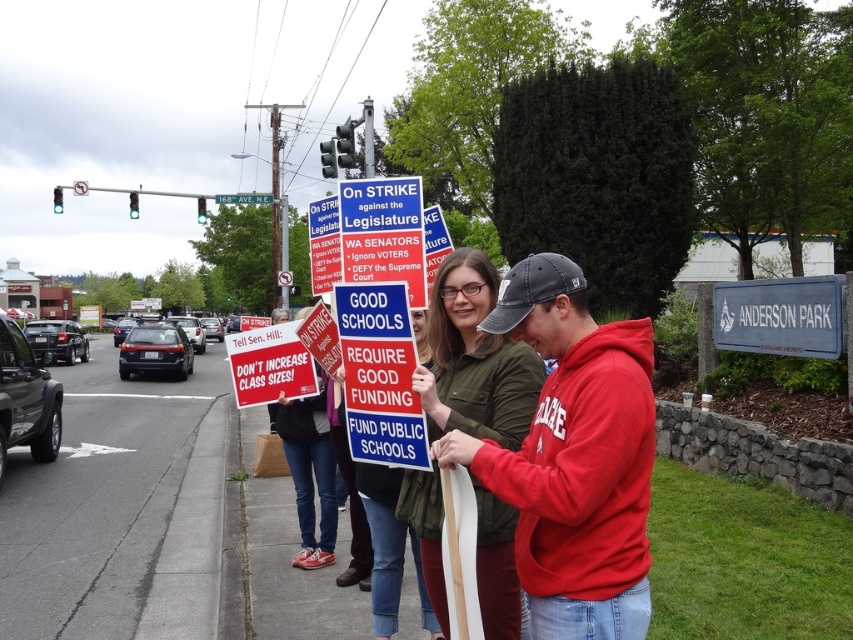
Does green fabric jacket at center appear on the left side of red plastic sign at center?

Incorrect, green fabric jacket at center is not on the left side of red plastic sign at center.

Measure the distance between point (500, 536) and camera.

Point (500, 536) and camera are 2.60 meters apart from each other.

I want to click on green fabric jacket at center, so click(474, 358).

The height and width of the screenshot is (640, 853). Describe the element at coordinates (573, 458) in the screenshot. I see `red fleece hoodie at center` at that location.

Between red fleece hoodie at center and red plastic sign at center, which one appears on the right side from the viewer's perspective?

Positioned to the right is red fleece hoodie at center.

Is point (479, 445) more distant than point (308, 380)?

That is False.

At what (x,y) coordinates should I click in order to perform the action: click on red fleece hoodie at center. Please return your answer as a coordinate pair (x, y). The image size is (853, 640). Looking at the image, I should click on (573, 458).

Between green fabric jacket at center and metallic blue street sign at upper center, which one has less height?

green fabric jacket at center is shorter.

Does green fabric jacket at center have a larger size compared to metallic blue street sign at upper center?

No.

Which is behind, point (473, 323) or point (215, 202)?

Positioned behind is point (215, 202).

Find the location of `green fabric jacket at center`. green fabric jacket at center is located at coordinates (474, 358).